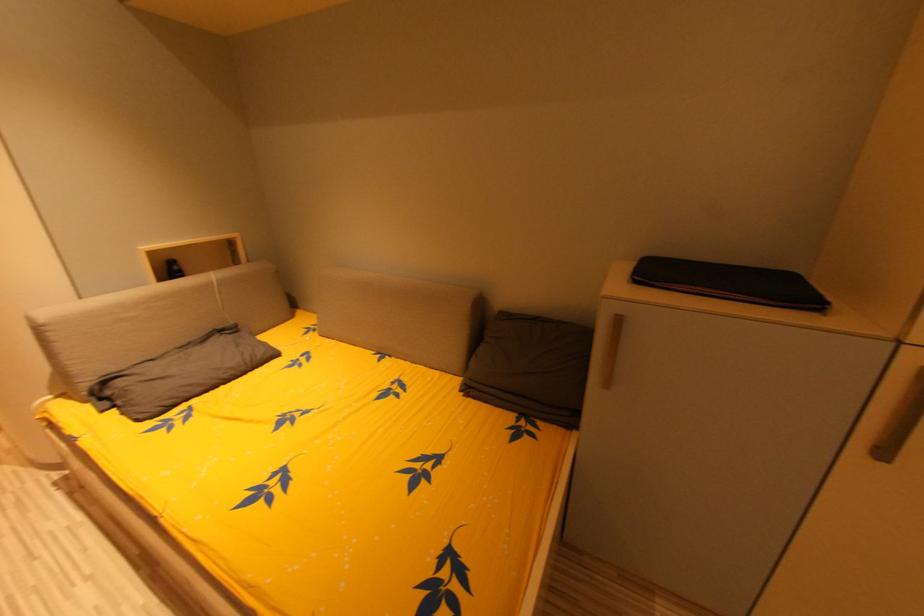
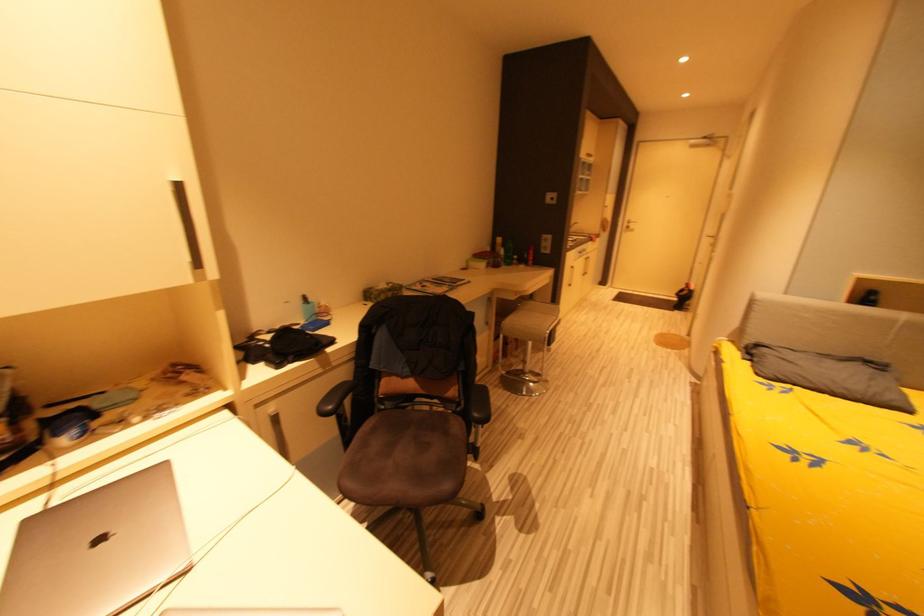
Based on the continuous images, in which direction is the camera rotating?

The camera's rotation is toward left-down.